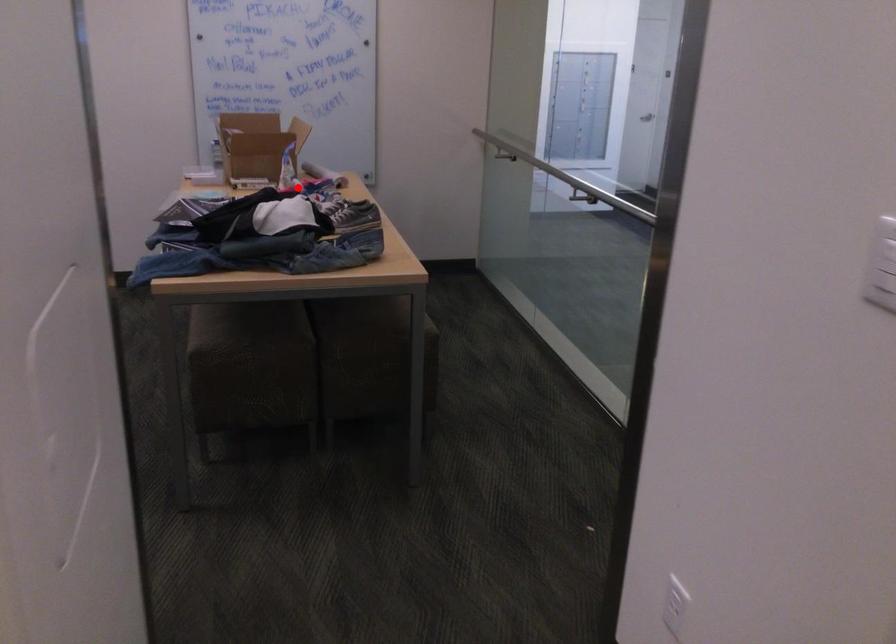
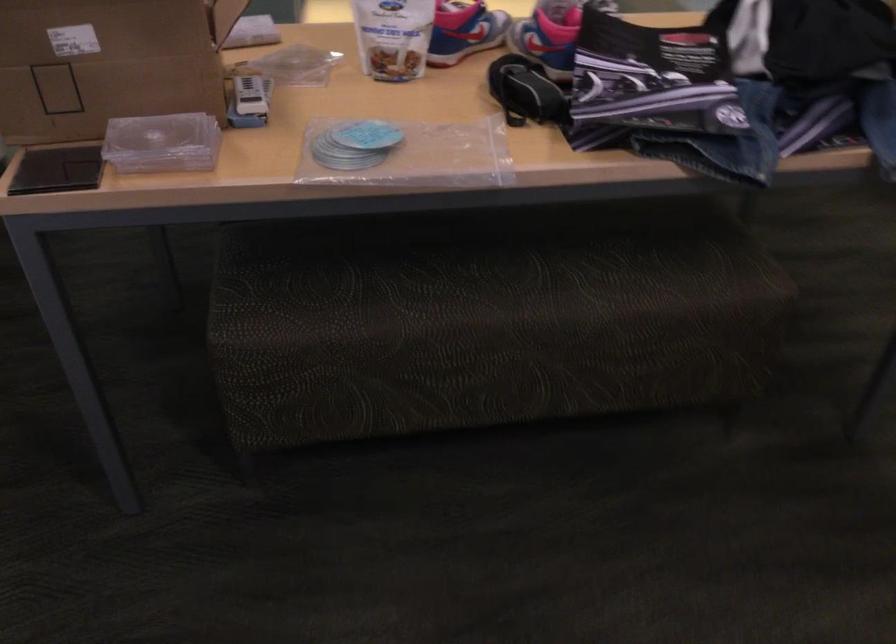
The point at the highlighted location is marked in the first image. Where is the corresponding point in the second image?

(463, 31)